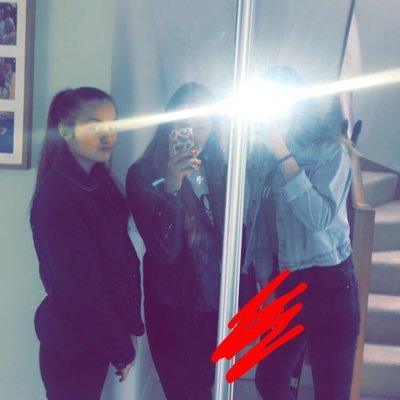
Where is `mirror`? The image size is (400, 400). mirror is located at coordinates (134, 145).